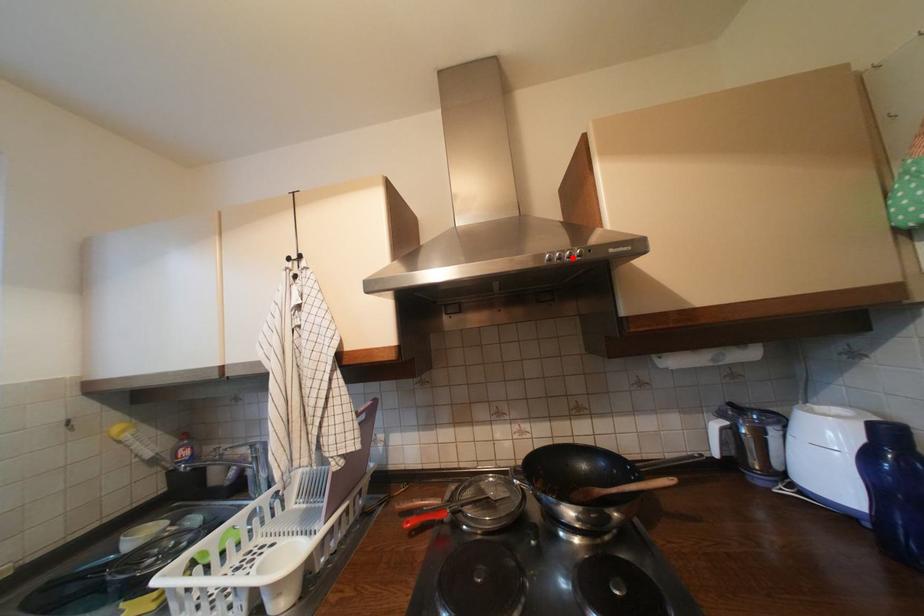
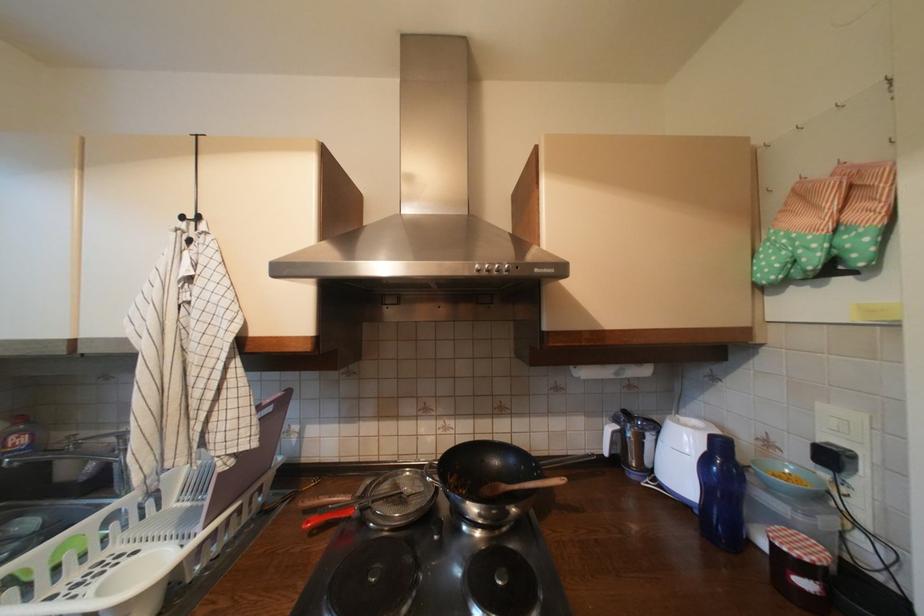
Locate, in the second image, the point that corresponds to the highlighted location in the first image.

(502, 270)